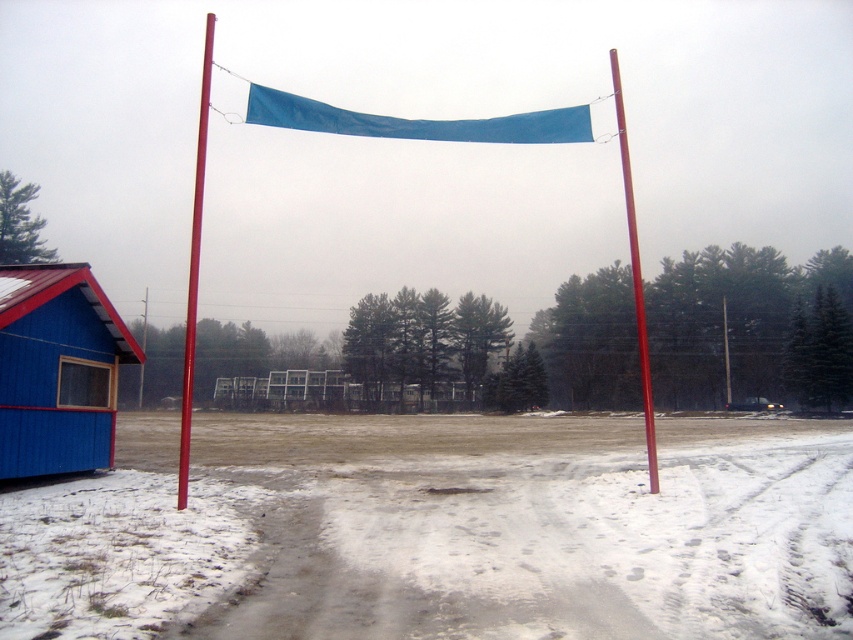
What is located at the coordinates point (x=561, y=547) in the image?

The point (x=561, y=547) marks gray compacted dirt at center.

You are standing at the edge of the volleyball court and want to walk to the blue wood hut at lower left. Which direction should you move relative to the gray compacted dirt at center?

You should move behind the gray compacted dirt at center towards the blue wood hut at lower left since the blue wood hut is located behind the dirt area.

You are planning to set up a picnic blanket in the winter scene. The picnic blanket is 2 meters wide. Can you place it on the gray compacted dirt at center without overlapping the blue wood hut at lower left?

The gray compacted dirt at center is wider than the blue wood hut at lower left, so placing a 2 meter wide picnic blanket on the gray compacted dirt at center should be possible without overlapping the blue wood hut at lower left, provided the dirt area is sufficiently wide.